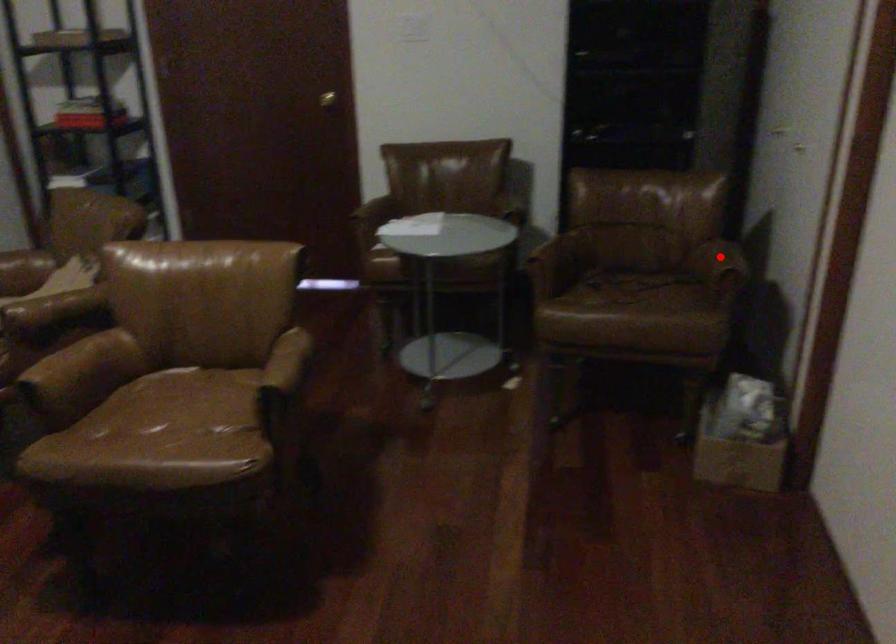
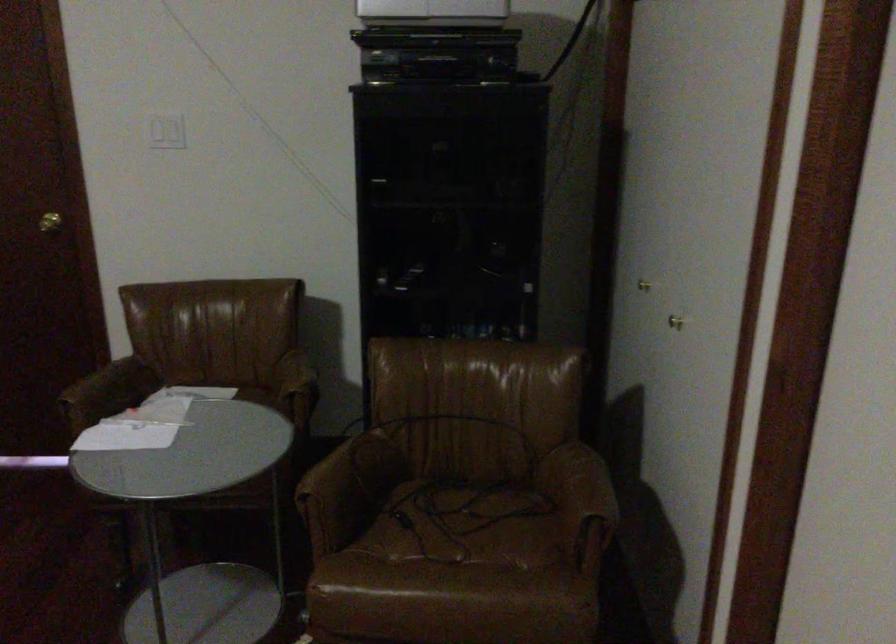
Question: A red point is marked in image1. In image2, is the corresponding 3D point closer to the camera or farther? Reply with the corresponding letter.

Choices:
 (A) The corresponding 3D point is closer.
 (B) The corresponding 3D point is farther.

Answer: (A)